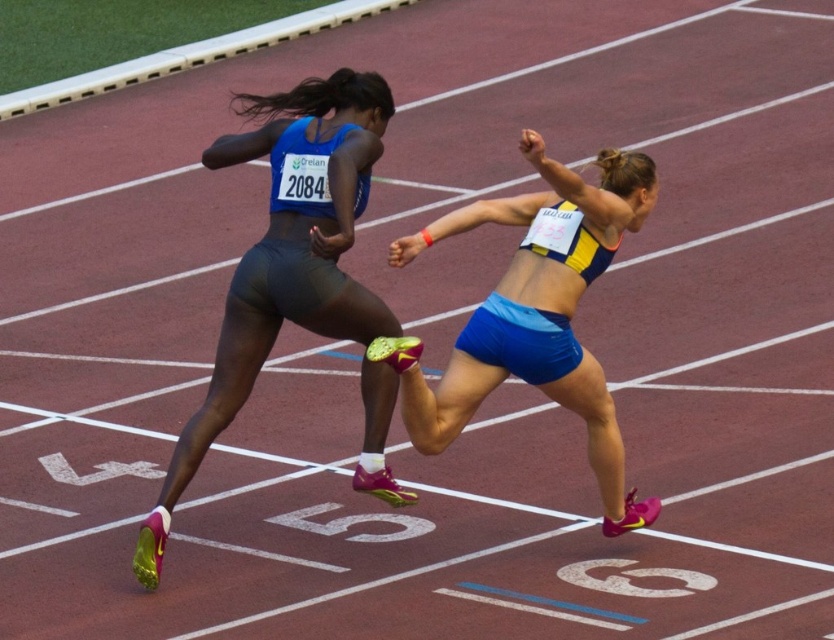
Who is higher up, matte blue shorts at center or blue fabric shorts at center?

Positioned higher is matte blue shorts at center.

Does matte blue shorts at center have a larger size compared to blue fabric shorts at center?

Yes, matte blue shorts at center is bigger than blue fabric shorts at center.

Is point (254, 365) positioned in front of point (506, 310)?

That is False.

This screenshot has height=640, width=834. In order to click on matte blue shorts at center in this screenshot , I will do `click(285, 257)`.